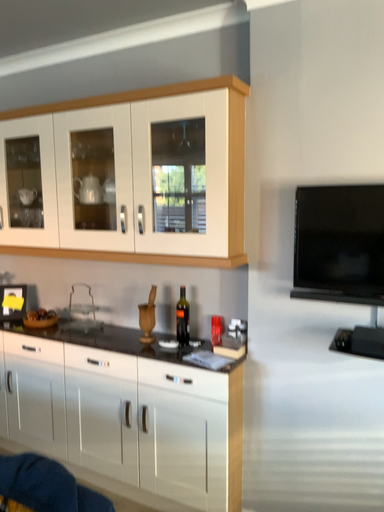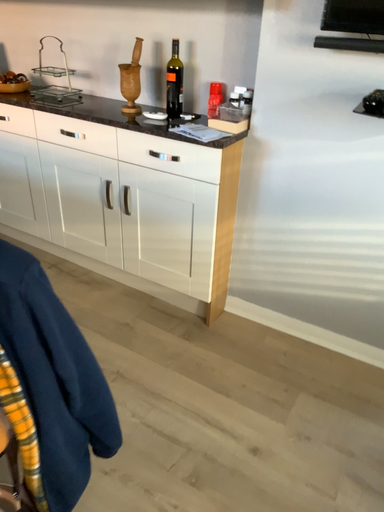
Question: How did the camera likely rotate when shooting the video?

Choices:
 (A) rotated upward
 (B) rotated downward

Answer: (B)